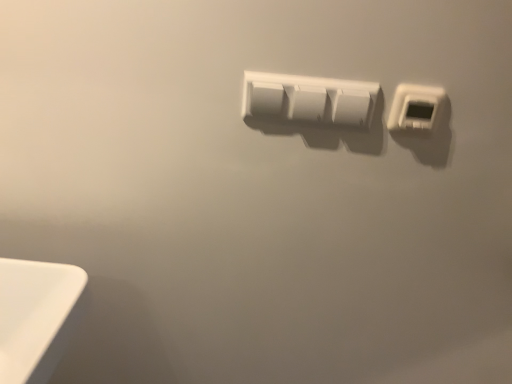
Question: Is point (429, 100) closer or farther from the camera than point (278, 104)?

Choices:
 (A) farther
 (B) closer

Answer: (B)

Question: From the image's perspective, relative to white plastic power plugs and sockets at center, which appears as the second power plugs and sockets when viewed from the right, is white plastic thermostat at upper right, which ranks as the 1th power plugs and sockets in right-to-left order, above or below?

Choices:
 (A) below
 (B) above

Answer: (A)

Question: From a real-world perspective, is white plastic thermostat at upper right, which appears as the second power plugs and sockets when viewed from the left, above or below white plastic power plugs and sockets at center, which appears as the second power plugs and sockets when viewed from the right?

Choices:
 (A) below
 (B) above

Answer: (B)

Question: In terms of height, does white plastic power plugs and sockets at center, which ranks as the first power plugs and sockets in left-to-right order, look taller or shorter compared to white plastic thermostat at upper right, which appears as the second power plugs and sockets when viewed from the left?

Choices:
 (A) short
 (B) tall

Answer: (B)

Question: Looking at their shapes, would you say white plastic power plugs and sockets at center, which ranks as the first power plugs and sockets in left-to-right order, is wider or thinner than white plastic thermostat at upper right, which ranks as the 1th power plugs and sockets in right-to-left order?

Choices:
 (A) thin
 (B) wide

Answer: (A)

Question: Is point (347, 89) closer or farther from the camera than point (428, 119)?

Choices:
 (A) closer
 (B) farther

Answer: (A)

Question: Would you say white plastic power plugs and sockets at center, which appears as the second power plugs and sockets when viewed from the right, is to the left or to the right of white plastic thermostat at upper right, which appears as the second power plugs and sockets when viewed from the left, in the picture?

Choices:
 (A) right
 (B) left

Answer: (B)